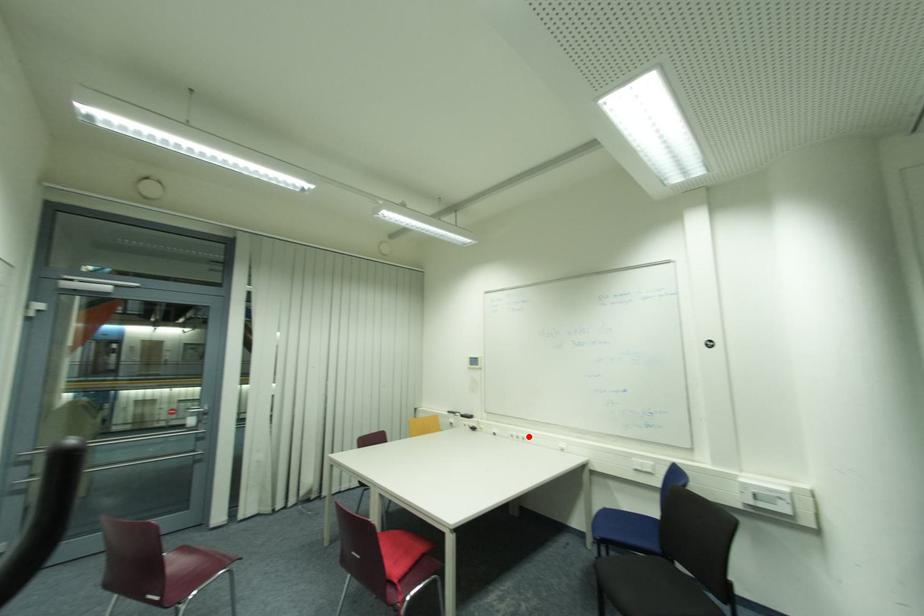
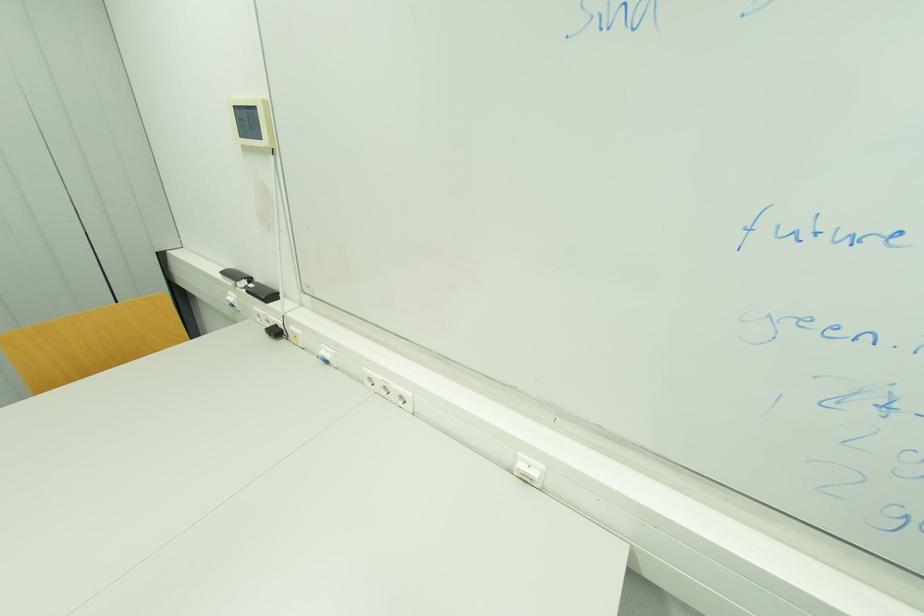
In the second image, find the point that corresponds to the highlighted location in the first image.

(409, 394)